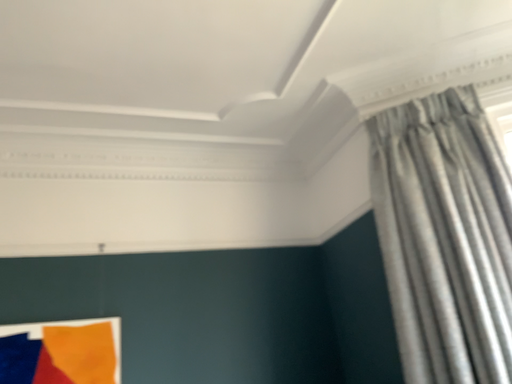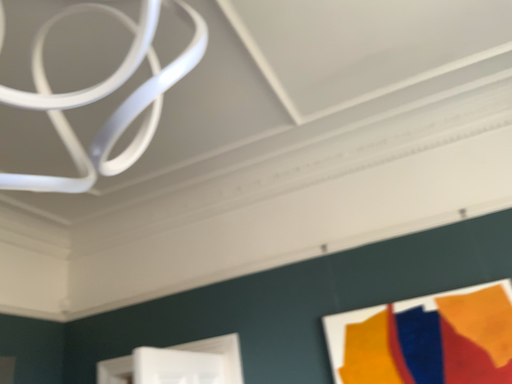
Question: How did the camera likely rotate when shooting the video?

Choices:
 (A) rotated right
 (B) rotated left

Answer: (B)